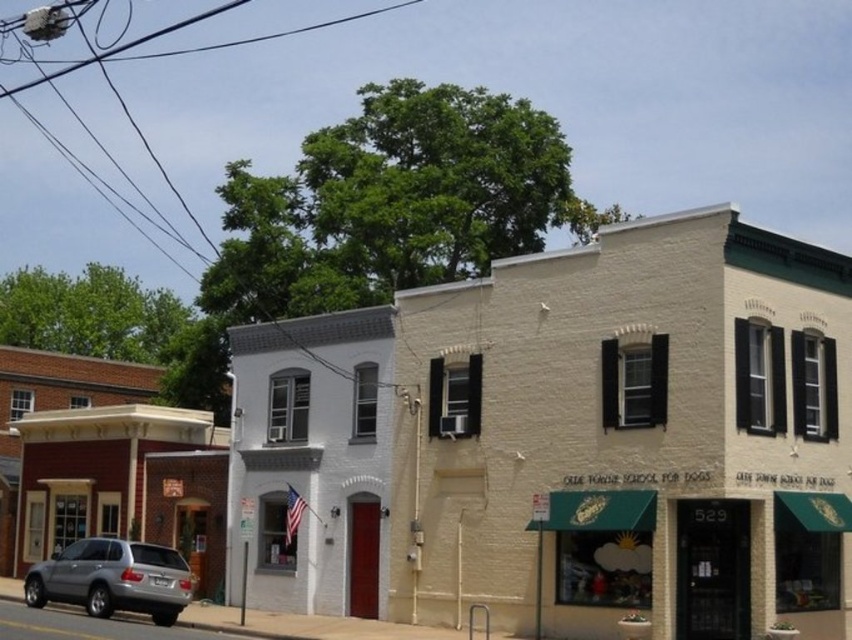
Does silver metallic suv at lower left have a greater height compared to black wire at upper center?

No.

Is point (72, 572) positioned before point (226, 6)?

Yes, point (72, 572) is in front of point (226, 6).

You are a GUI agent. You are given a task and a screenshot of the screen. Output one action in this format:
    pyautogui.click(x=<x>, y=<y>)
    Task: Click on the silver metallic suv at lower left
    This screenshot has height=640, width=852.
    Given the screenshot: What is the action you would take?
    pyautogui.click(x=113, y=579)

Looking at this image, who is positioned more to the right, white matte building at center or black wire at upper center?

white matte building at center

Who is shorter, white matte building at center or black wire at upper center?

white matte building at center is shorter.

Where is `white matte building at center`? Image resolution: width=852 pixels, height=640 pixels. white matte building at center is located at coordinates (563, 440).

Image resolution: width=852 pixels, height=640 pixels. I want to click on white matte building at center, so click(563, 440).

The height and width of the screenshot is (640, 852). What do you see at coordinates (563, 440) in the screenshot?
I see `white matte building at center` at bounding box center [563, 440].

Is point (453, 344) less distant than point (56, 6)?

That is False.

You are a GUI agent. You are given a task and a screenshot of the screen. Output one action in this format:
    pyautogui.click(x=<x>, y=<y>)
    Task: Click on the white matte building at center
    The image size is (852, 640).
    Given the screenshot: What is the action you would take?
    pyautogui.click(x=563, y=440)